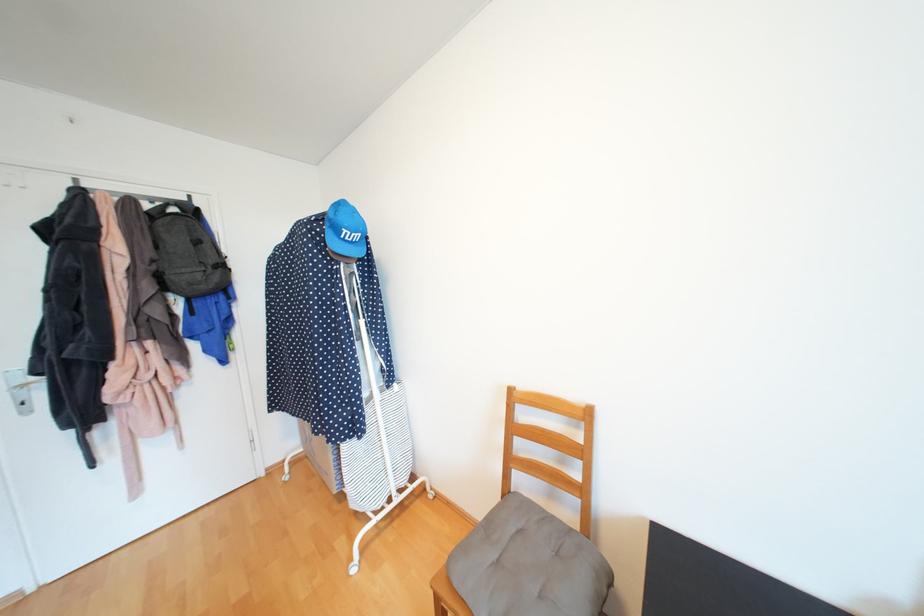
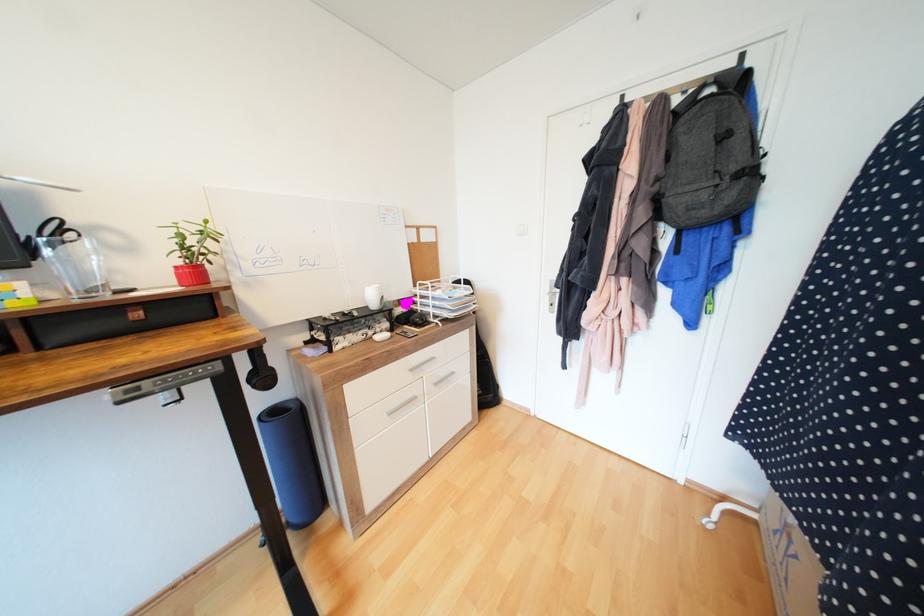
Based on the continuous images, in which direction is the camera rotating?

The camera's rotation is toward left-down.